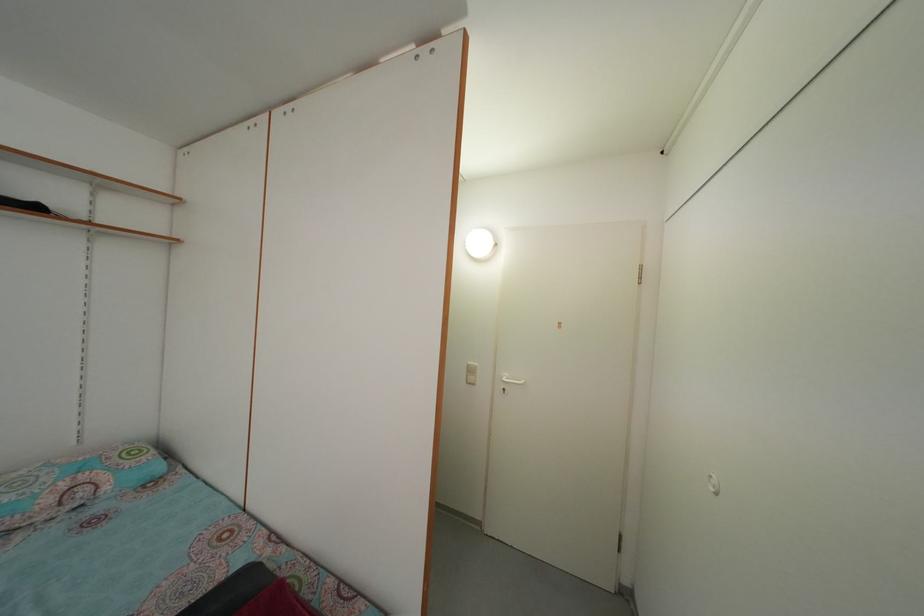
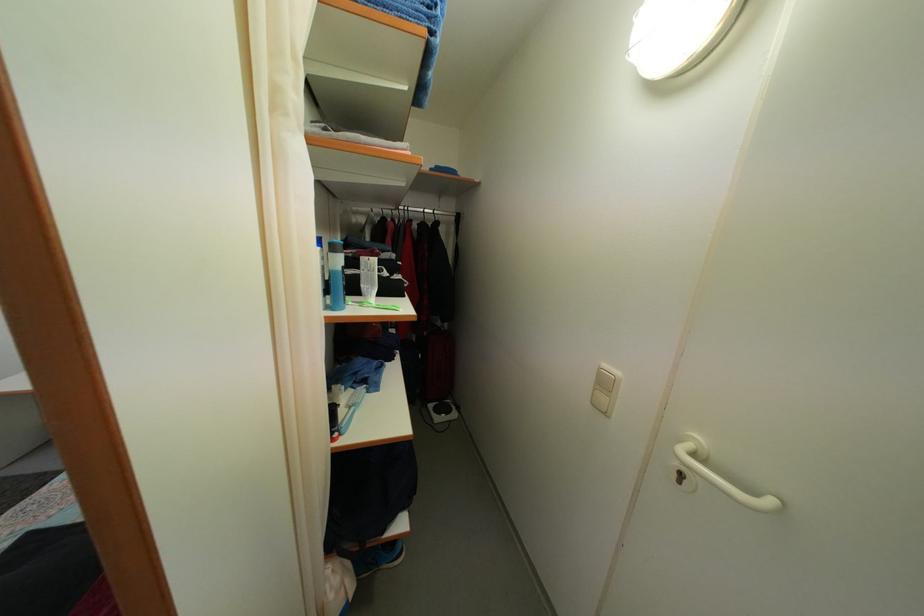
Question: The first image is from the beginning of the video and the second image is from the end. How did the camera likely rotate when shooting the video?

Choices:
 (A) Left
 (B) Right
 (C) Up
 (D) Down

Answer: (A)